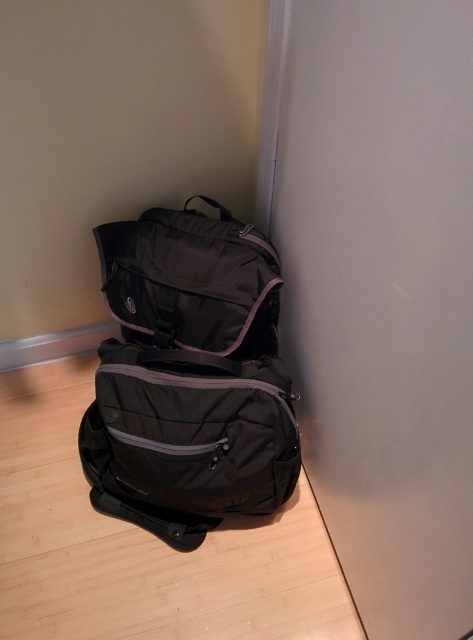
You need to place a ruler between the matte black backpack at lower left and the matte black bag at upper left. What is the minimum length of the ruler required to reach both ends?

The minimum length of the ruler required to reach both ends is 19.22 centimeters, as the distance between the matte black backpack at lower left and the matte black bag at upper left is exactly 19.22 centimeters.

You are organizing a storage closet and need to know if the matte black backpack at lower left can fit into a shelf space that is the same height as the matte black bag at upper left. Can it fit?

The matte black backpack at lower left is taller than the matte black bag at upper left. Therefore, it cannot fit into a shelf space that is the same height as the matte black bag at upper left.